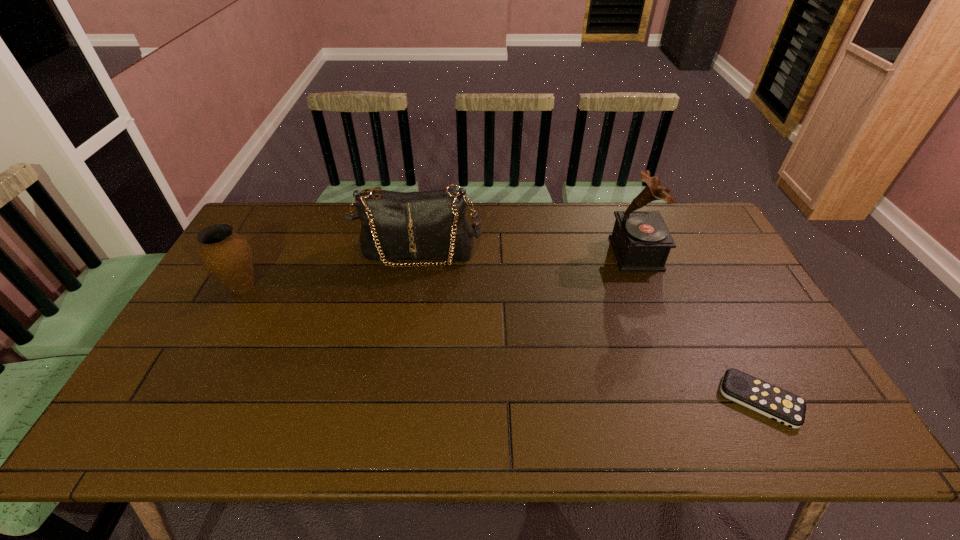
At what (x,y) coordinates should I click in order to perform the action: click on free space between the phonograph_record and the urn. Please return your answer as a coordinate pair (x, y). This screenshot has height=540, width=960. Looking at the image, I should click on (440, 271).

You are a GUI agent. You are given a task and a screenshot of the screen. Output one action in this format:
    pyautogui.click(x=<x>, y=<y>)
    Task: Click on the free spot between the phonograph_record and the second object from left to right
    This screenshot has width=960, height=540.
    Given the screenshot: What is the action you would take?
    pyautogui.click(x=527, y=253)

Identify the location of object that is the nearest to the nearest object. The height and width of the screenshot is (540, 960). (641, 241).

The width and height of the screenshot is (960, 540). In order to click on object that can be found as the third closest to the phonograph_record in this screenshot , I will do `click(227, 256)`.

Find the location of a particular element. This screenshot has height=540, width=960. free point that satisfies the following two spatial constraints: 1. at the front of the remote control with chain and zipper; 2. on the right side of the handbag is located at coordinates 396,400.

Where is `free point that satisfies the following two spatial constraints: 1. at the horn opening of the phonograph_record; 2. on the front side of the leftmost object`? The image size is (960, 540). free point that satisfies the following two spatial constraints: 1. at the horn opening of the phonograph_record; 2. on the front side of the leftmost object is located at coordinates (649, 287).

At what (x,y) coordinates should I click in order to perform the action: click on free space that satisfies the following two spatial constraints: 1. on the front side of the remote control; 2. on the left side of the leftmost object. Please return your answer as a coordinate pair (x, y). Looking at the image, I should click on (181, 400).

You are a GUI agent. You are given a task and a screenshot of the screen. Output one action in this format:
    pyautogui.click(x=<x>, y=<y>)
    Task: Click on the blank space that satisfies the following two spatial constraints: 1. at the front of the handbag with chain and zipper; 2. on the right side of the nearest object
    The width and height of the screenshot is (960, 540).
    Given the screenshot: What is the action you would take?
    pyautogui.click(x=396, y=400)

The image size is (960, 540). What are the coordinates of `free point that satisfies the following two spatial constraints: 1. on the back side of the nearest object; 2. at the horn opening of the phonograph_record` in the screenshot? It's located at (685, 253).